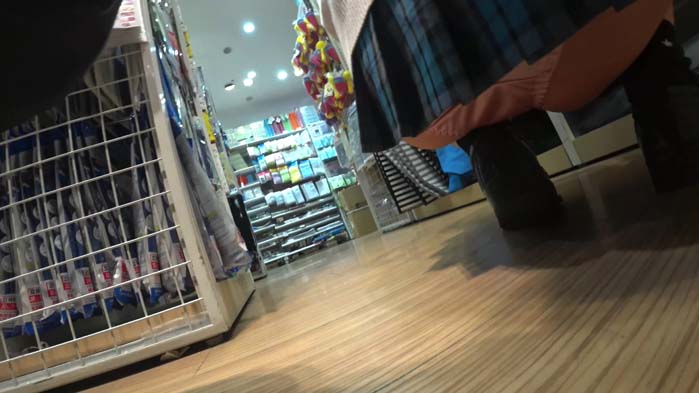
Find the location of `shelves`. shelves is located at coordinates (284, 219).